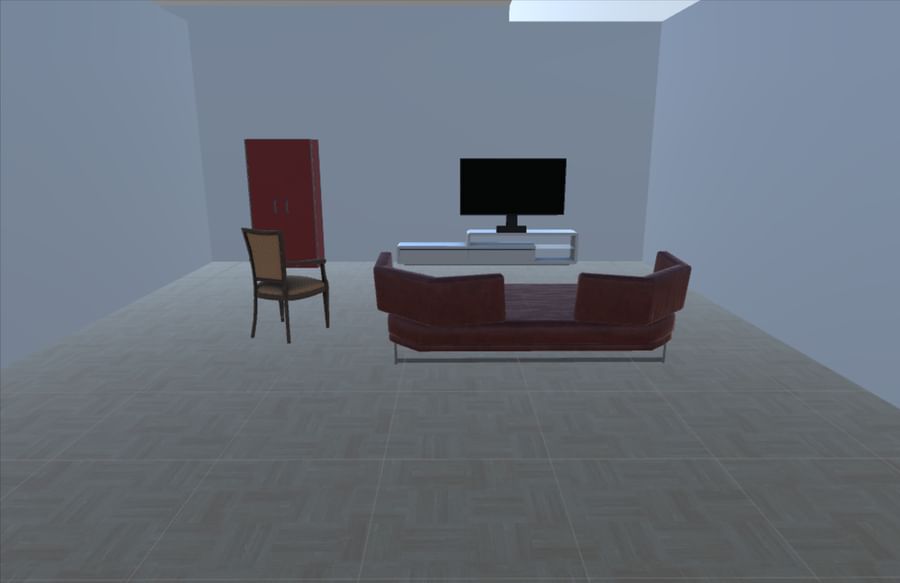
Locate an element on the screen. This screenshot has height=583, width=900. tv console table is located at coordinates (500, 247).